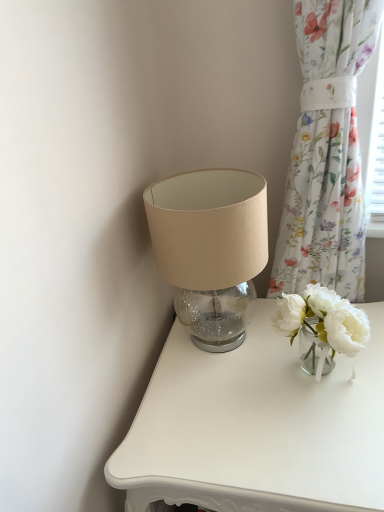
Question: From a real-world perspective, is floral fabric curtain at right beneath white matte vase at right?

Choices:
 (A) yes
 (B) no

Answer: (B)

Question: Is the depth of floral fabric curtain at right less than that of white matte vase at right?

Choices:
 (A) yes
 (B) no

Answer: (A)

Question: Is floral fabric curtain at right smaller than white matte vase at right?

Choices:
 (A) no
 (B) yes

Answer: (A)

Question: Can white matte vase at right be found inside floral fabric curtain at right?

Choices:
 (A) yes
 (B) no

Answer: (B)

Question: From the image's perspective, does floral fabric curtain at right appear higher than white matte vase at right?

Choices:
 (A) no
 (B) yes

Answer: (B)

Question: From the image's perspective, is floral fabric curtain at right beneath white matte vase at right?

Choices:
 (A) yes
 (B) no

Answer: (B)

Question: From a real-world perspective, is white matte vase at right located beneath floral fabric curtain at right?

Choices:
 (A) no
 (B) yes

Answer: (B)

Question: Considering the relative positions of white matte vase at right and floral fabric curtain at right in the image provided, is white matte vase at right to the right of floral fabric curtain at right from the viewer's perspective?

Choices:
 (A) yes
 (B) no

Answer: (B)

Question: Is white matte vase at right with floral fabric curtain at right?

Choices:
 (A) no
 (B) yes

Answer: (A)

Question: Is white matte vase at right not within floral fabric curtain at right?

Choices:
 (A) yes
 (B) no

Answer: (A)

Question: Does white matte vase at right have a greater width compared to floral fabric curtain at right?

Choices:
 (A) yes
 (B) no

Answer: (A)

Question: Considering the relative sizes of white matte vase at right and floral fabric curtain at right in the image provided, is white matte vase at right thinner than floral fabric curtain at right?

Choices:
 (A) yes
 (B) no

Answer: (B)

Question: Considering their positions, is floral fabric curtain at right located in front of or behind white matte vase at right?

Choices:
 (A) front
 (B) behind

Answer: (A)